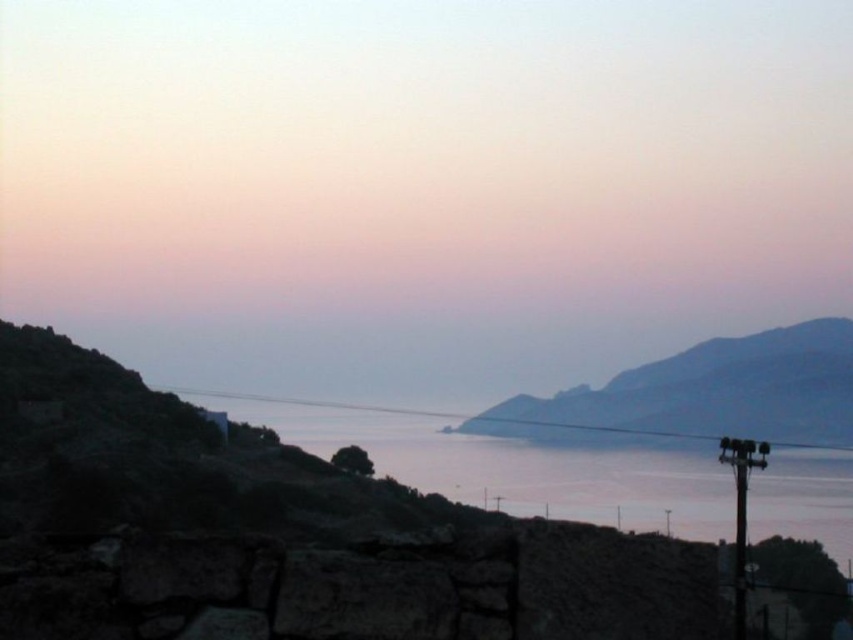
How distant is smooth stone wall at lower left from clear water at center?

They are 36.03 meters apart.

How much distance is there between smooth stone wall at lower left and clear water at center?

They are 36.03 meters apart.

Image resolution: width=853 pixels, height=640 pixels. Describe the element at coordinates (421, 186) in the screenshot. I see `smooth stone wall at lower left` at that location.

Image resolution: width=853 pixels, height=640 pixels. I want to click on smooth stone wall at lower left, so click(421, 186).

Does smooth stone wall at lower left lie in front of smooth gray rock at center?

No, smooth stone wall at lower left is further to the viewer.

Is smooth stone wall at lower left below smooth gray rock at center?

No, smooth stone wall at lower left is not below smooth gray rock at center.

The height and width of the screenshot is (640, 853). What are the coordinates of `smooth stone wall at lower left` in the screenshot? It's located at (421, 186).

Can you confirm if clear water at center is smaller than smooth gray rock at center?

No, clear water at center is not smaller than smooth gray rock at center.

Who is positioned more to the right, clear water at center or smooth gray rock at center?

From the viewer's perspective, smooth gray rock at center appears more on the right side.

Is point (422, 444) less distant than point (584, 440)?

That is True.

Locate an element on the screen. This screenshot has height=640, width=853. clear water at center is located at coordinates (555, 477).